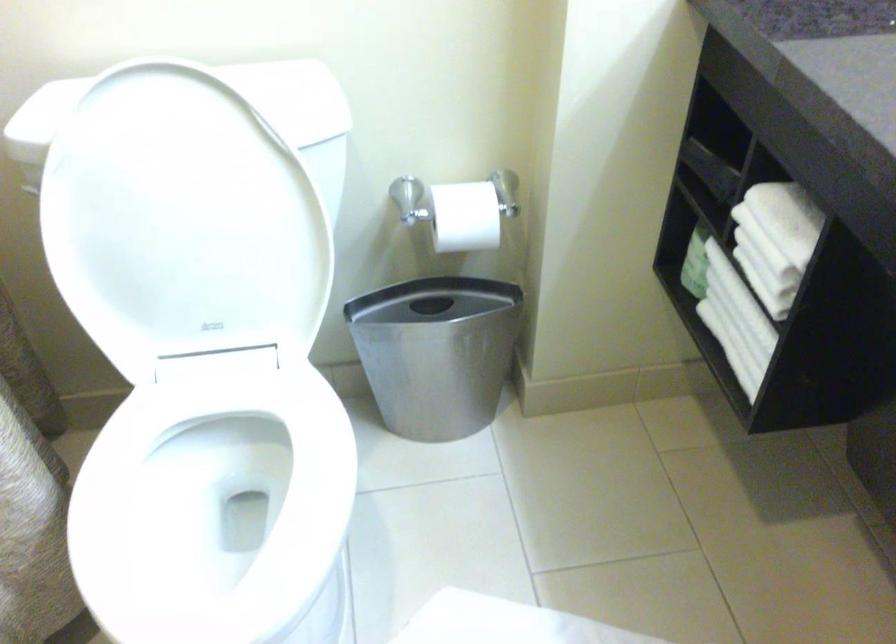
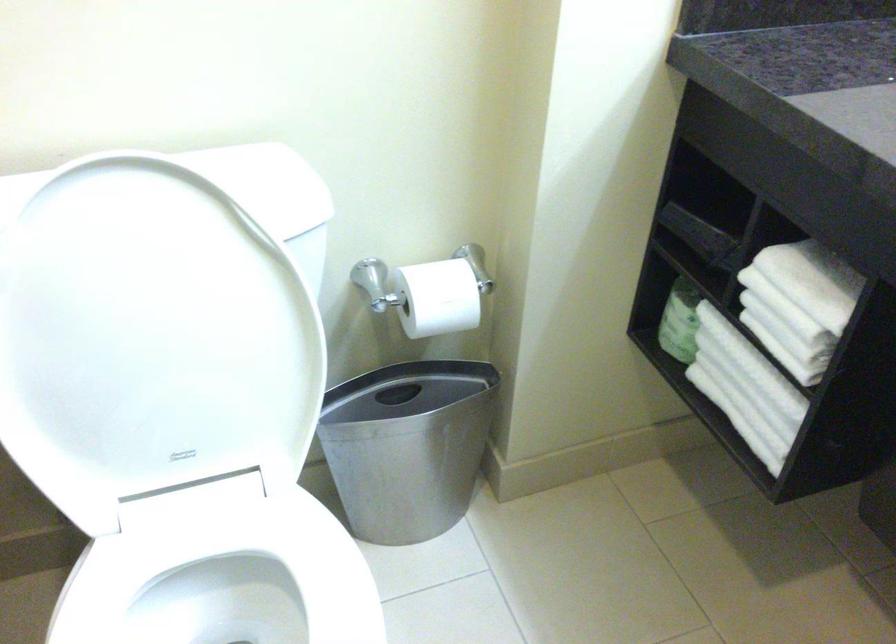
Locate, in the second image, the point that corresponds to the point at 192,207 in the first image.

(159, 323)